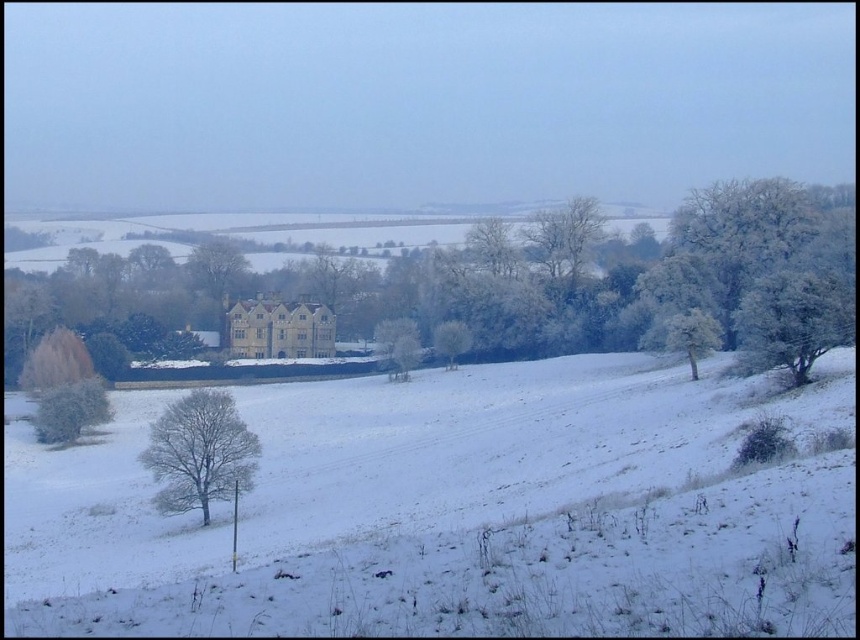
Which is more to the left, white frosty tree at lower left or green frosted bush at lower left?

From the viewer's perspective, green frosted bush at lower left appears more on the left side.

Identify the location of white frosty tree at lower left. tap(200, 452).

Who is positioned more to the right, frosted white tree at right or white frosty tree at center?

frosted white tree at right

Who is positioned more to the left, frosted white tree at right or white frosty tree at center?

From the viewer's perspective, white frosty tree at center appears more on the left side.

Does point (845, 336) come in front of point (449, 356)?

That is True.

Image resolution: width=860 pixels, height=640 pixels. In order to click on frosted white tree at right in this screenshot , I will do `click(791, 323)`.

Locate an element on the screen. white frosty tree at lower left is located at coordinates (200, 452).

Does point (238, 470) come in front of point (447, 340)?

That is True.

Between point (207, 417) and point (465, 352), which one is positioned behind?

The point (465, 352) is behind.

Where is `white frosty tree at lower left`? Image resolution: width=860 pixels, height=640 pixels. white frosty tree at lower left is located at coordinates (200, 452).